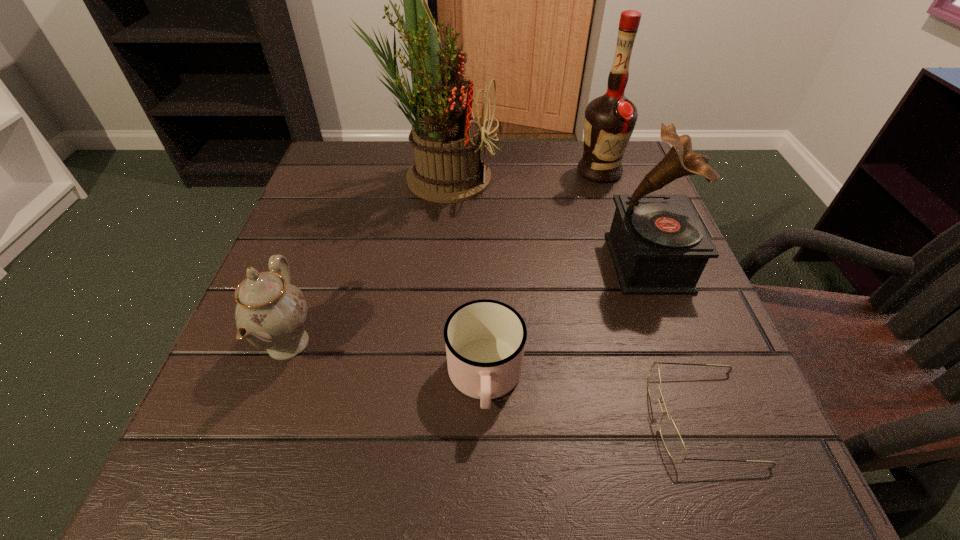
Where is `vacant space at the left edge`? The width and height of the screenshot is (960, 540). vacant space at the left edge is located at coordinates [304, 418].

Identify the location of free space at the right edge of the desktop. This screenshot has height=540, width=960. (702, 424).

Locate an element on the screen. The width and height of the screenshot is (960, 540). vacant space at the far left corner of the desktop is located at coordinates (376, 163).

This screenshot has width=960, height=540. Find the location of `vacant space at the near left corner of the desktop`. vacant space at the near left corner of the desktop is located at coordinates (188, 483).

In the image, there is a desktop. What are the coordinates of `free space at the near right corner` in the screenshot? It's located at (727, 469).

Locate an element on the screen. free space between the fifth shortest object and the fourth tallest object is located at coordinates (444, 258).

The image size is (960, 540). I want to click on free space between the leftmost object and the second shortest object, so 386,361.

What are the coordinates of `vacant point located between the chinaware and the liquor` in the screenshot? It's located at (444, 258).

At what (x,y) coordinates should I click in order to perform the action: click on free space between the third tallest object and the shortest object. Please return your answer as a coordinate pair (x, y). Image resolution: width=960 pixels, height=540 pixels. Looking at the image, I should click on (675, 340).

Where is `vacant region between the mug and the fourth shortest object`? Image resolution: width=960 pixels, height=540 pixels. vacant region between the mug and the fourth shortest object is located at coordinates (566, 321).